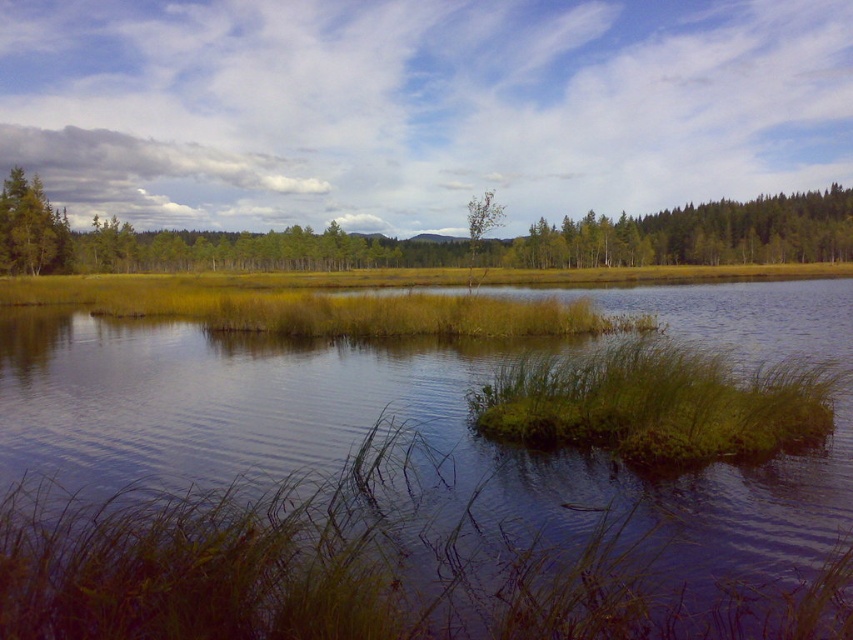
You are standing at the edge of the water and looking towards the green grassy forest at upper left and the green leafy grass at center. Which of these two areas is closer to you?

The green grassy forest at upper left is closer to you because it is in front of the green leafy grass at center.

You are planning to cross the green grassy lake at center and the green grassy forest at upper left. Which path would require you to walk a shorter distance?

The green grassy lake at center has a smaller width than the green grassy forest at upper left, so crossing the green grassy lake at center would require walking a shorter distance.

You are standing in the serene landscape and want to walk from the point closer to you to the point further away. Which path would you take between the two points, point [194,236] and point [807,387]?

Answer: You should walk from point [194,236] to point [807,387] because point [194,236] is closer to you and point [807,387] is further away, so that path goes from near to far.